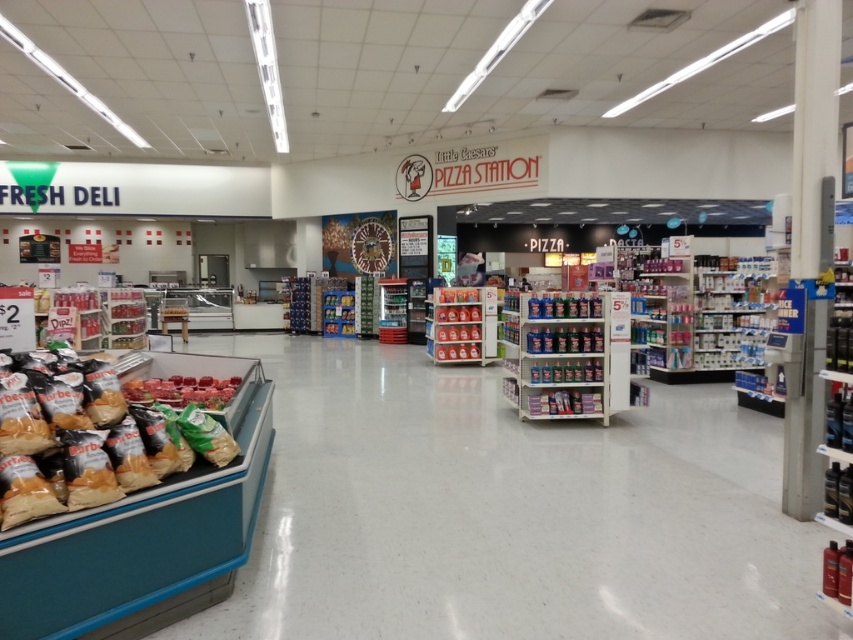
Does golden brown chips at lower left have a lesser width compared to matte plastic soda bottles at center?

Indeed, golden brown chips at lower left has a lesser width compared to matte plastic soda bottles at center.

Consider the image. Is golden brown chips at lower left shorter than matte plastic soda bottles at center?

Yes, golden brown chips at lower left is shorter than matte plastic soda bottles at center.

Between point (47, 456) and point (474, 330), which one is positioned behind?

Point (474, 330)

At what (x,y) coordinates should I click in order to perform the action: click on golden brown chips at lower left. Please return your answer as a coordinate pair (x, y). The image size is (853, 640). Looking at the image, I should click on (82, 436).

Which is more to the right, golden brown chips at lower left or shiny red meat at center?

golden brown chips at lower left

Does golden brown chips at lower left appear over shiny red meat at center?

Yes.

The width and height of the screenshot is (853, 640). I want to click on golden brown chips at lower left, so click(x=82, y=436).

I want to click on matte plastic soda bottles at center, so click(462, 324).

Between point (477, 353) and point (227, 380), which one is positioned behind?

Point (477, 353)

Locate an element on the screen. matte plastic soda bottles at center is located at coordinates (462, 324).